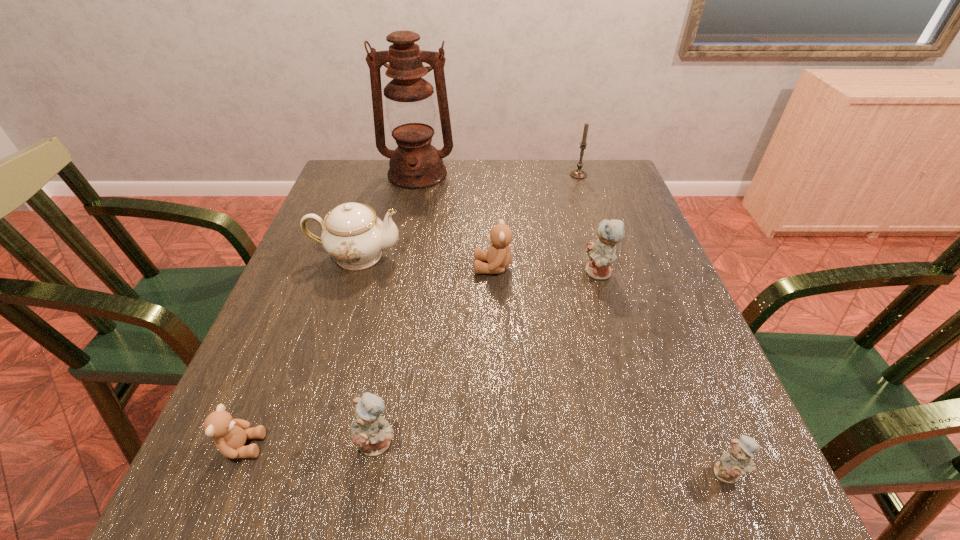
At what (x,y) coordinates should I click in order to perform the action: click on oil lamp. Please return your answer as a coordinate pair (x, y). The image size is (960, 540). Looking at the image, I should click on (415, 164).

Where is `candle`? The width and height of the screenshot is (960, 540). candle is located at coordinates (578, 173).

Where is `the tallest teddy bear`? Image resolution: width=960 pixels, height=540 pixels. the tallest teddy bear is located at coordinates (601, 252).

Locate an element on the screen. the biggest blue teddy bear is located at coordinates (601, 252).

This screenshot has width=960, height=540. I want to click on chinaware, so pos(352,234).

At what (x,y) coordinates should I click in order to perform the action: click on the bigger brown teddy bear. Please return your answer as a coordinate pair (x, y). Image resolution: width=960 pixels, height=540 pixels. Looking at the image, I should click on (499, 255).

Image resolution: width=960 pixels, height=540 pixels. What are the coordinates of `the third teddy bear from right to left` in the screenshot? It's located at tap(499, 255).

The width and height of the screenshot is (960, 540). Find the location of `the second farthest blue teddy bear`. the second farthest blue teddy bear is located at coordinates (371, 433).

Find the location of `the leftmost blue teddy bear`. the leftmost blue teddy bear is located at coordinates (371, 433).

You are a GUI agent. You are given a task and a screenshot of the screen. Output one action in this format:
    pyautogui.click(x=<x>, y=<y>)
    Task: Click on the nearer brown teddy bear
    The image size is (960, 540).
    Given the screenshot: What is the action you would take?
    pyautogui.click(x=229, y=434)